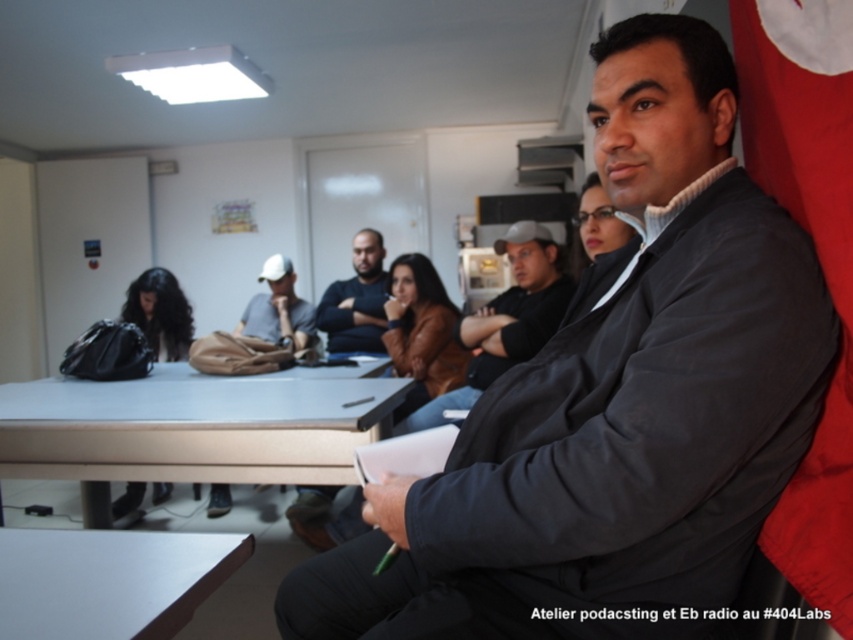
In the scene shown: You are standing in the classroom and want to place a heavy textbook on the metallic gray table at lower center. However, there is a dark gray sweater at center on top of it. Can you place the textbook there without moving the sweater?

The metallic gray table at lower center is below the dark gray sweater at center, meaning the sweater is currently on the table. Therefore, you cannot place the textbook there without moving the sweater.

You are standing in the classroom and want to hand a document to the person at point (799, 20). If you can reach 35 inches, can you reach them without moving?

The distance between you and the person at point (799, 20) is 34.96 inches, so yes, you can reach them without moving since your reach is slightly longer than the distance.

You are organizing a small workshop in this classroom and need to seat two participants. One participant requires a table large enough to spread out materials, and the other needs a space to place a sweater. Given the metallic gray table at lower center and the dark gray sweater at center, which object can accommodate the first participant and why?

The metallic gray table at lower center can accommodate the first participant because it is larger in size than the dark gray sweater at center, making it suitable for spreading out materials.